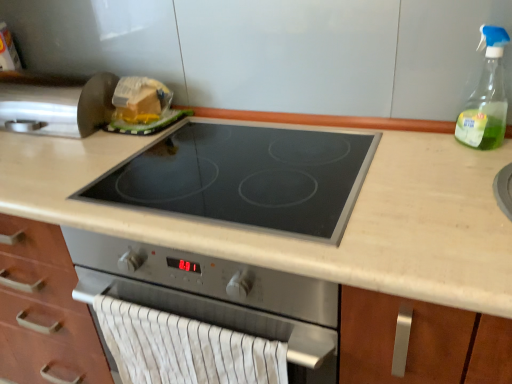
Question: Can you confirm if clear glass spray bottle at upper right is bigger than white striped fabric hand towel at lower center?

Choices:
 (A) yes
 (B) no

Answer: (B)

Question: Is clear glass spray bottle at upper right positioned beyond the bounds of white striped fabric hand towel at lower center?

Choices:
 (A) no
 (B) yes

Answer: (B)

Question: Is clear glass spray bottle at upper right turned away from white striped fabric hand towel at lower center?

Choices:
 (A) no
 (B) yes

Answer: (A)

Question: Considering the relative sizes of clear glass spray bottle at upper right and white striped fabric hand towel at lower center in the image provided, is clear glass spray bottle at upper right shorter than white striped fabric hand towel at lower center?

Choices:
 (A) no
 (B) yes

Answer: (B)

Question: Does clear glass spray bottle at upper right have a lesser width compared to white striped fabric hand towel at lower center?

Choices:
 (A) yes
 (B) no

Answer: (B)

Question: Based on their sizes in the image, would you say white striped fabric hand towel at lower center is bigger or smaller than black glass cooktop at center?

Choices:
 (A) big
 (B) small

Answer: (B)

Question: Considering the positions of point (234, 347) and point (237, 206), is point (234, 347) closer or farther from the camera than point (237, 206)?

Choices:
 (A) farther
 (B) closer

Answer: (B)

Question: From the image's perspective, is white striped fabric hand towel at lower center located above or below black glass cooktop at center?

Choices:
 (A) below
 (B) above

Answer: (A)

Question: Is white striped fabric hand towel at lower center spatially inside black glass cooktop at center, or outside of it?

Choices:
 (A) inside
 (B) outside

Answer: (B)

Question: Is black glass cooktop at center taller or shorter than metallic silver knife at upper left?

Choices:
 (A) short
 (B) tall

Answer: (A)

Question: Considering the relative positions of black glass cooktop at center and metallic silver knife at upper left in the image provided, is black glass cooktop at center to the left or to the right of metallic silver knife at upper left?

Choices:
 (A) right
 (B) left

Answer: (A)

Question: Considering the positions of black glass cooktop at center and metallic silver knife at upper left in the image, is black glass cooktop at center bigger or smaller than metallic silver knife at upper left?

Choices:
 (A) big
 (B) small

Answer: (B)

Question: From the image's perspective, is black glass cooktop at center located above or below metallic silver knife at upper left?

Choices:
 (A) above
 (B) below

Answer: (B)

Question: From a real-world perspective, is black glass cooktop at center physically located above or below translucent plastic cheese at upper left?

Choices:
 (A) above
 (B) below

Answer: (B)

Question: Considering the positions of black glass cooktop at center and translucent plastic cheese at upper left in the image, is black glass cooktop at center taller or shorter than translucent plastic cheese at upper left?

Choices:
 (A) tall
 (B) short

Answer: (B)